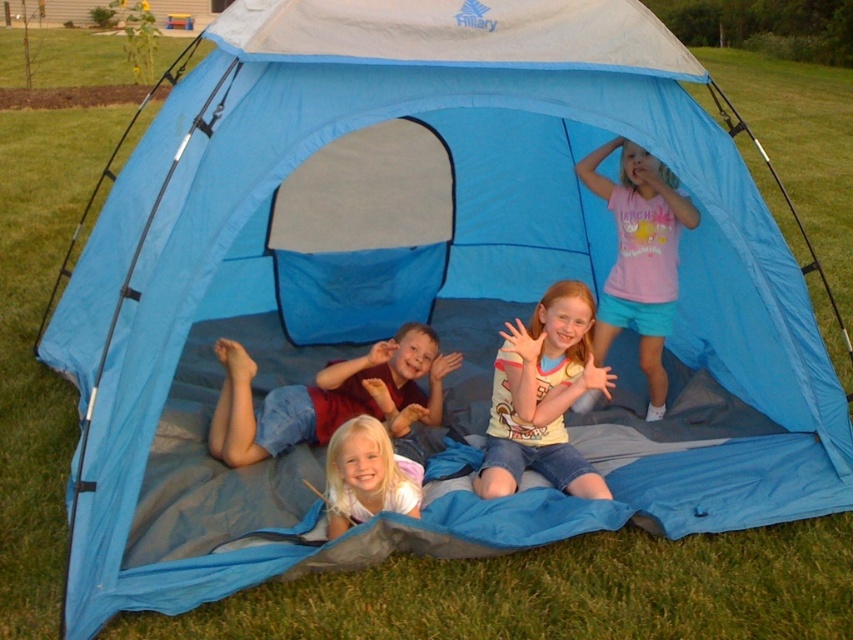
Question: Which of these objects is positioned farthest from the smooth white shirt at center?

Choices:
 (A) striped cotton shirt at center
 (B) light blonde hair at center

Answer: (B)

Question: Which point is farther to the camera?

Choices:
 (A) striped cotton shirt at center
 (B) light blonde hair at center
 (C) smooth white shirt at center

Answer: (B)

Question: Is striped cotton shirt at center further to the viewer compared to pink cotton shirt at upper center?

Choices:
 (A) no
 (B) yes

Answer: (A)

Question: Does striped cotton shirt at center have a smaller size compared to light blonde hair at center?

Choices:
 (A) no
 (B) yes

Answer: (B)

Question: Can you confirm if light blonde hair at center is positioned above pink cotton shirt at upper center?

Choices:
 (A) yes
 (B) no

Answer: (B)

Question: Which point is closer to the camera?

Choices:
 (A) smooth white shirt at center
 (B) pink cotton shirt at upper center

Answer: (A)